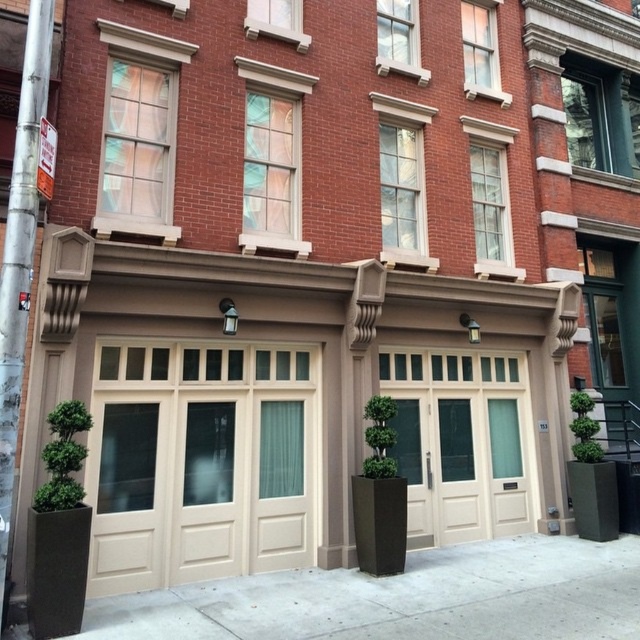
You are standing in front of the brick building and want to take a photo. You notice two points marked on the building facade at coordinates point (298, 365) and point (273, 588). Which point is closer to your camera when taking the photo?

Point (273, 588) is closer to the camera because it is less further than point (298, 365).